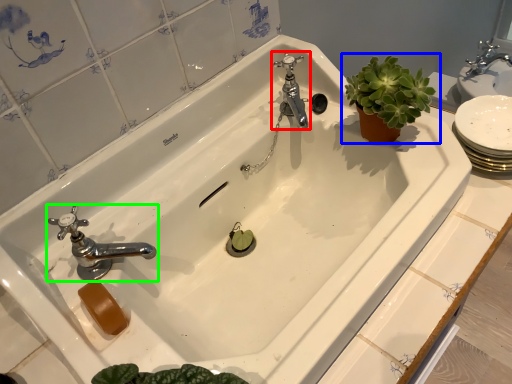
Question: Estimate the real-world distances between objects in this image. Which object is farther from tap (highlighted by a red box), houseplant (highlighted by a blue box) or tap (highlighted by a green box)?

Choices:
 (A) houseplant
 (B) tap

Answer: (B)